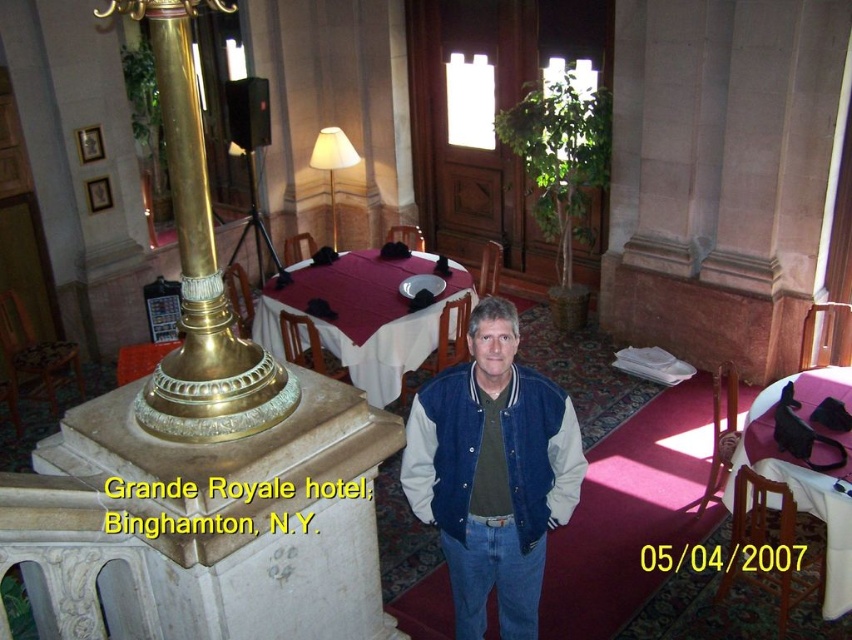
Does point (436, 314) come behind point (847, 536)?

Yes, it is behind point (847, 536).

Is point (429, 268) less distant than point (730, 484)?

No.

Which is behind, point (353, 252) or point (826, 368)?

Positioned behind is point (353, 252).

Find the location of a particular element. This screenshot has width=852, height=640. maroon fabric table at center is located at coordinates (361, 316).

From the picture: Who is more distant from viewer, (531, 396) or (723, 490)?

The point (723, 490) is more distant.

Is blue suede jacket at center behind pink fabric table at lower right?

No.

Where is `blue suede jacket at center`? blue suede jacket at center is located at coordinates (492, 472).

Locate an element on the screen. Image resolution: width=852 pixels, height=640 pixels. blue suede jacket at center is located at coordinates (492, 472).

Is blue suede jacket at center above maroon fabric table at center?

Incorrect, blue suede jacket at center is not positioned above maroon fabric table at center.

This screenshot has width=852, height=640. In order to click on blue suede jacket at center in this screenshot , I will do `click(492, 472)`.